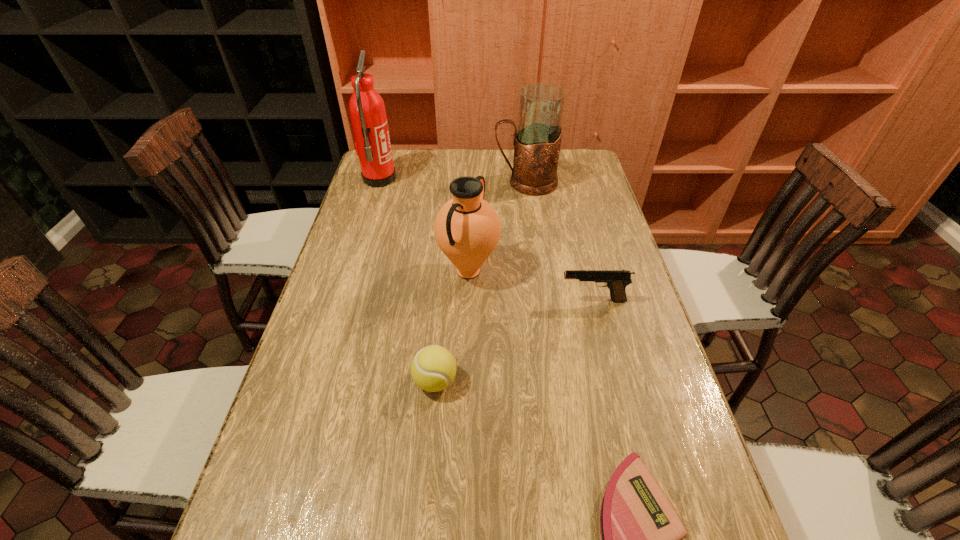
Locate an element on the screen. The height and width of the screenshot is (540, 960). empty space between the farther pitcher and the tennis ball is located at coordinates (480, 282).

Choose which object is the nearest neighbor to the fire extinguisher. Please provide its 2D coordinates. Your answer should be formatted as a tuple, i.e. [(x, y)], where the tuple contains the x and y coordinates of a point satisfying the conditions above.

[(537, 139)]

Select which object appears as the fourth closest to the third farthest object. Please provide its 2D coordinates. Your answer should be formatted as a tuple, i.e. [(x, y)], where the tuple contains the x and y coordinates of a point satisfying the conditions above.

[(367, 110)]

The image size is (960, 540). I want to click on vacant space that satisfies the following two spatial constraints: 1. on the label side of the fire extinguisher; 2. on the right side of the tennis ball, so (317, 381).

Locate an element on the screen. vacant space that satisfies the following two spatial constraints: 1. on the label side of the fourth nearest object; 2. on the right side of the leftmost object is located at coordinates (350, 271).